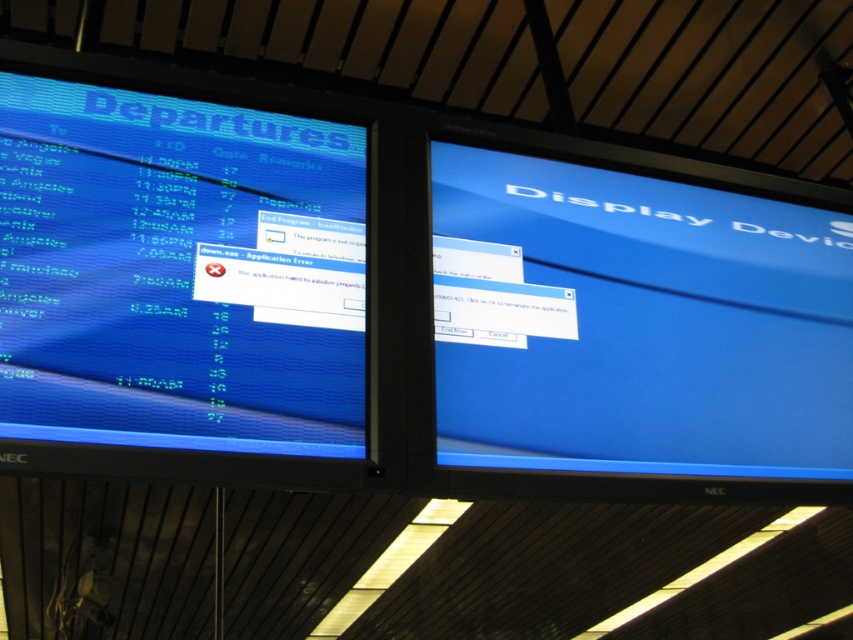
Question: Which point is farther to the camera?

Choices:
 (A) matte blue display at left
 (B) blue glossy monitor at center

Answer: (B)

Question: Can you confirm if matte blue display at left is bigger than blue glossy monitor at center?

Choices:
 (A) yes
 (B) no

Answer: (B)

Question: Which point is closer to the camera?

Choices:
 (A) matte blue display at left
 (B) blue glossy monitor at center

Answer: (A)

Question: Can you confirm if matte blue display at left is thinner than blue glossy monitor at center?

Choices:
 (A) no
 (B) yes

Answer: (B)

Question: Considering the relative positions of matte blue display at left and blue glossy monitor at center in the image provided, where is matte blue display at left located with respect to blue glossy monitor at center?

Choices:
 (A) right
 (B) left

Answer: (B)